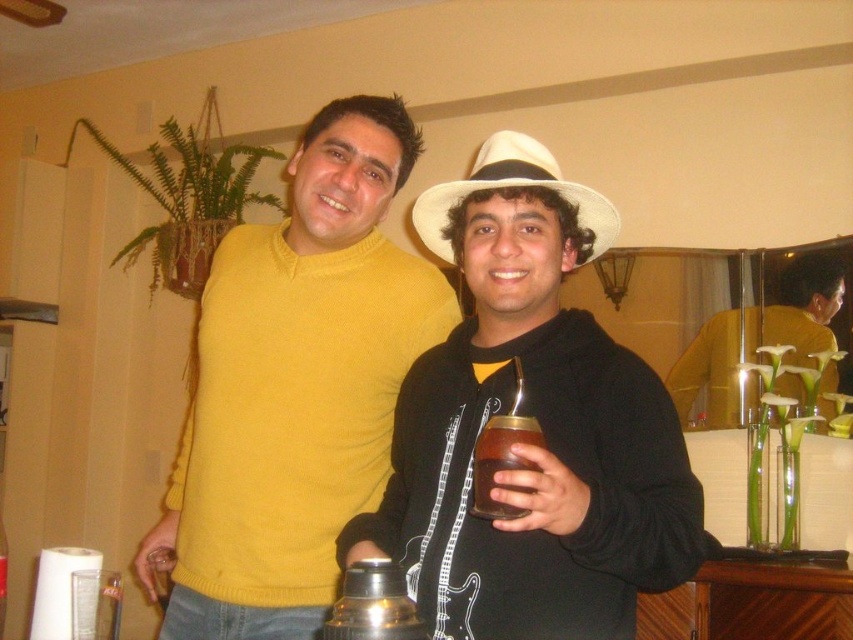
You are a photographer setting up a shoot in this room. You need to position a small light above both the white matte hat at center and the yellow sweater at center. Based on their positions, where should you place the light?

The white matte hat at center is below the yellow sweater at center, so you should place the light above the yellow sweater at center to ensure it is positioned above both objects.

You are a delivery person who needs to place a small package between the white felt hat at center and the brushed metal thermos at lower center. Can you fit it there?

The white felt hat at center is bigger than the brushed metal thermos at lower center, but the question is about fitting a small package between them. Since the objects are positioned at the center and lower center, there might be enough space between them for the package.